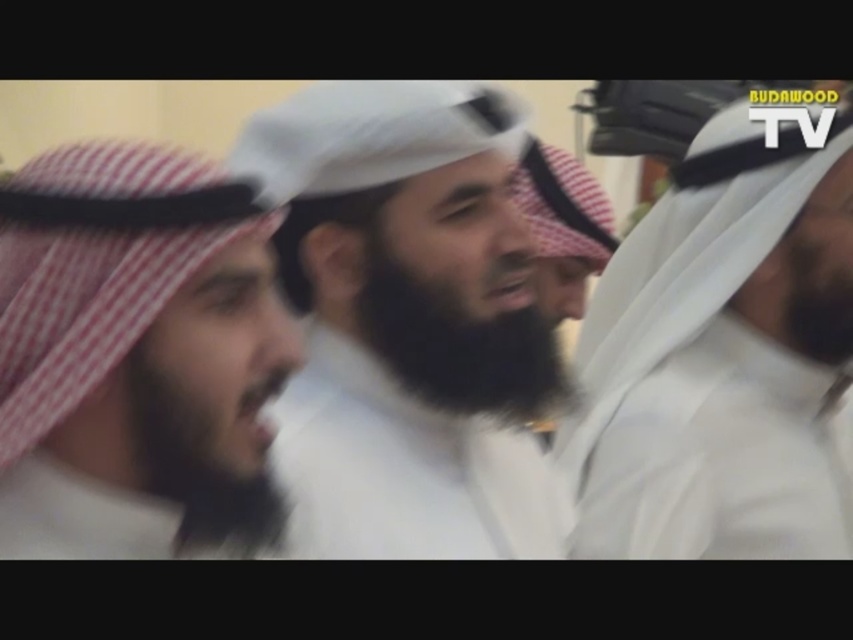
You are standing in the room and want to determine which of the two points, point (115, 266) or point (502, 355), is nearer to you. Based on the scene, which point is closer?

Point (115, 266) is closer to the camera than point (502, 355), so it is nearer to you.